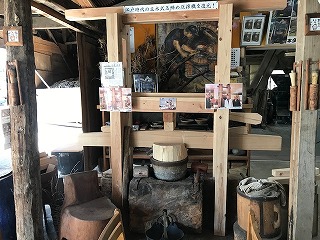
This screenshot has height=240, width=320. Find the location of `small wooden slab`. small wooden slab is located at coordinates (285, 171).